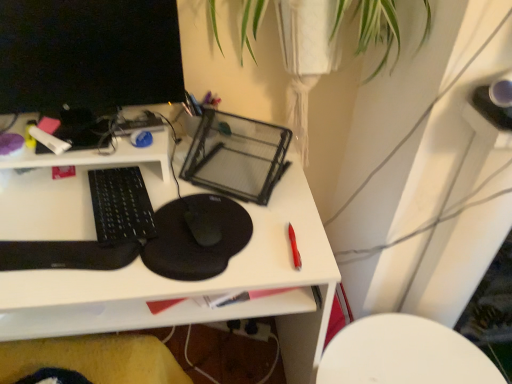
Locate an element on the screen. The width and height of the screenshot is (512, 384). free spot to the right of black matte mousepad at center is located at coordinates (x=282, y=229).